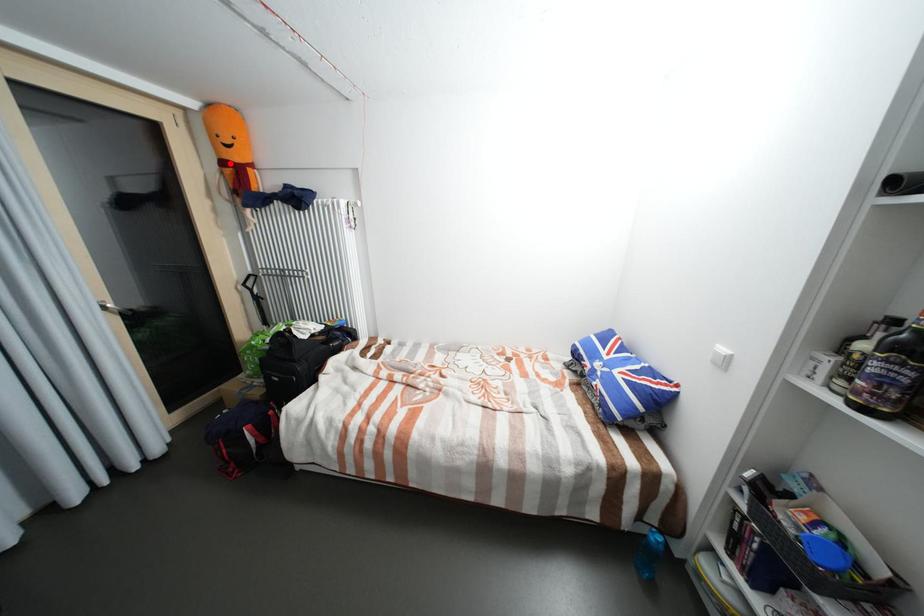
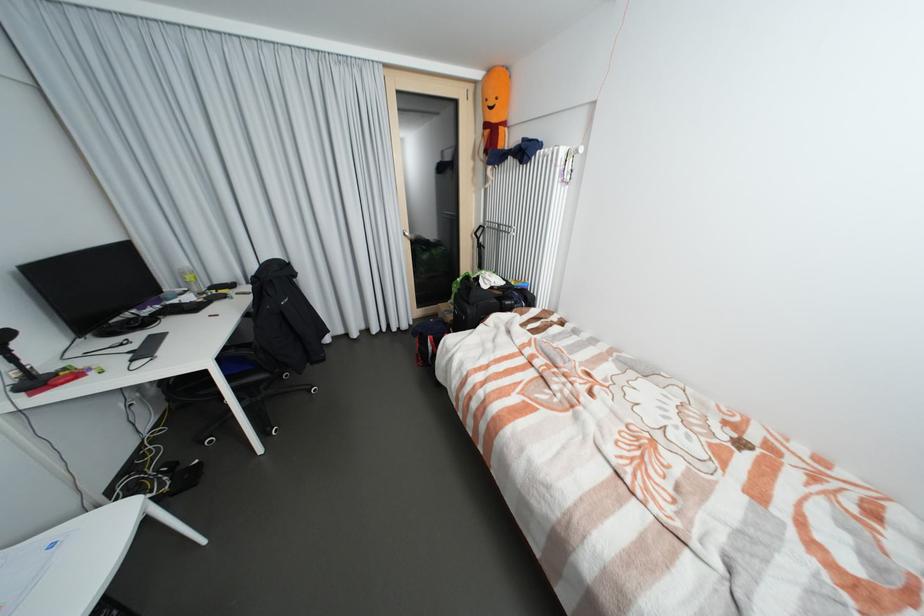
Question: I am providing you with two images of the same scene from different viewpoints. Given a red point in image1, look at the same physical point in image2. Is it:

Choices:
 (A) Closer to the viewpoint
 (B) Farther from the viewpoint

Answer: (A)